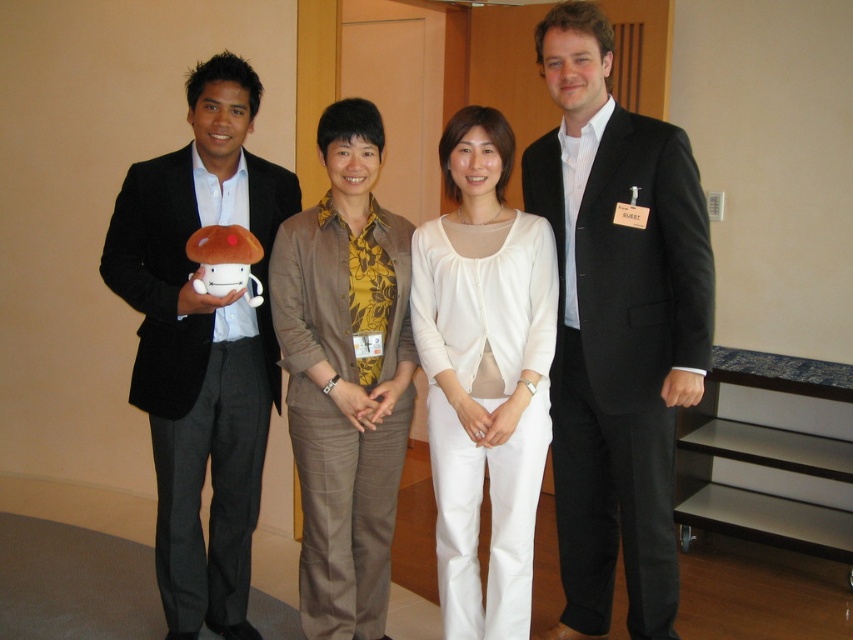
You are organizing a photo shoot and need to position two models wearing the black suit at center and white matte blouse at center. The minimum distance required between them for the shot is 10 inches. Based on the scene description, will they be able to maintain the required distance?

The black suit at center is 10.29 inches from the white matte blouse at center, which meets the minimum distance requirement of 10 inches. They can maintain the required distance.

Based on the photo, you are organizing a photo shoot and need to arrange two models wearing the black suit at center and the white matte blouse at center. Which model should you place first if you want to maximize space efficiency?

The black suit at center has a larger width than the white matte blouse at center, so you should place the black suit at center first to maximize space efficiency.